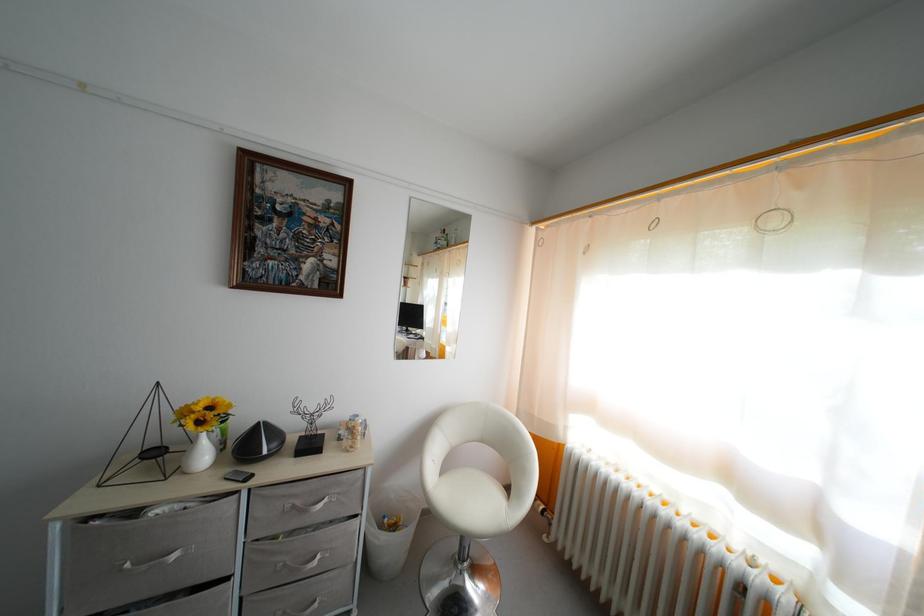
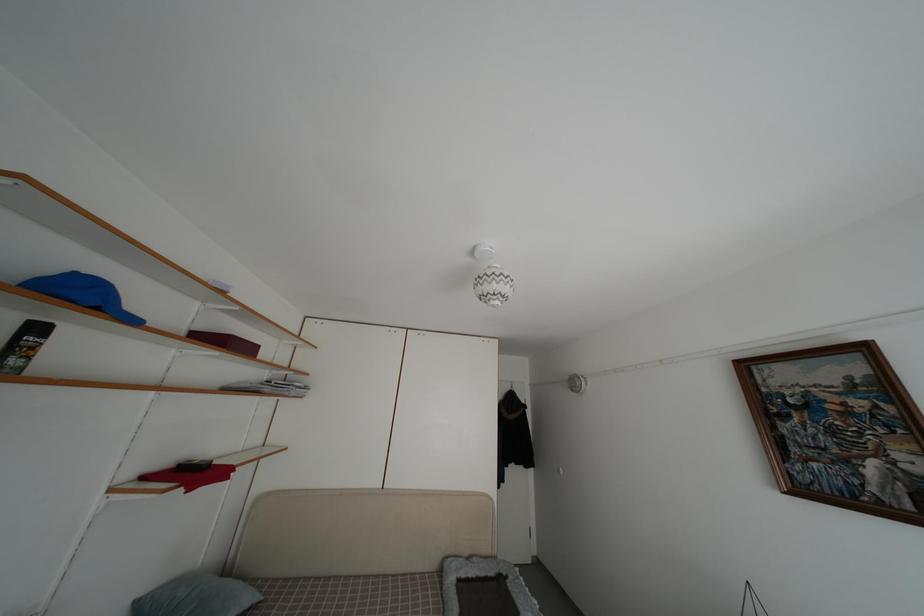
The images are taken continuously from a first-person perspective. In which direction is your viewpoint rotating?

The rotation direction of the camera is left-up.